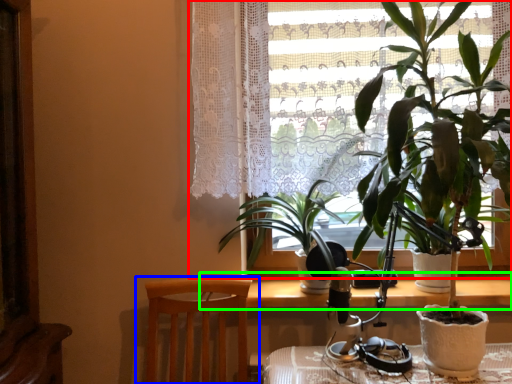
Question: Which is nearer to the window (highlighted by a red box)? chair (highlighted by a blue box) or table (highlighted by a green box).

Choices:
 (A) chair
 (B) table

Answer: (A)